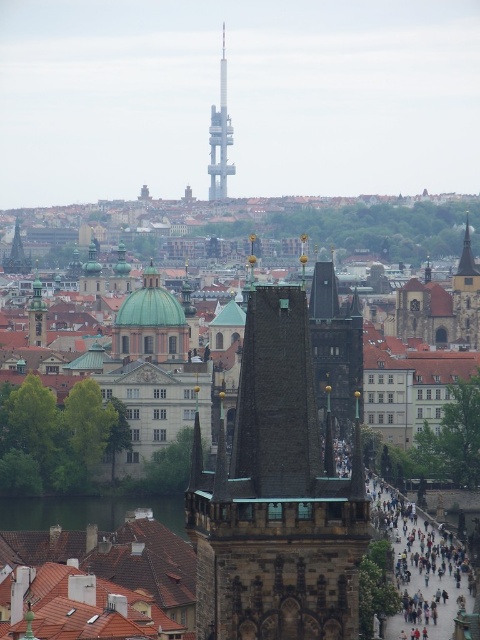
You are an architect evaluating the structural integrity of the dark gray stone tower at center and the dark gray stone bridge at lower right. Based on their sizes, which one might require more robust foundational support?

The dark gray stone tower at center is larger in size than the dark gray stone bridge at lower right, so it likely requires more robust foundational support due to its greater mass and height.

You are a tourist standing on the pedestrian bridge in the scene. You want to take a photo that includes both the green water at lower left and the smooth gray tower at center. Since you have a wide angle lens, will you be able to fit both into the frame without moving your position?

The green water at lower left is wider than the smooth gray tower at center, so yes, you can fit both into the frame using a wide angle lens without moving your position.

You are a tourist standing in the city square, looking at the dark gray stone tower at center and the smooth gray tower at center. Which tower is positioned lower in the scene?

The dark gray stone tower at center is positioned lower than the smooth gray tower at center, as it is located below it in the scene.